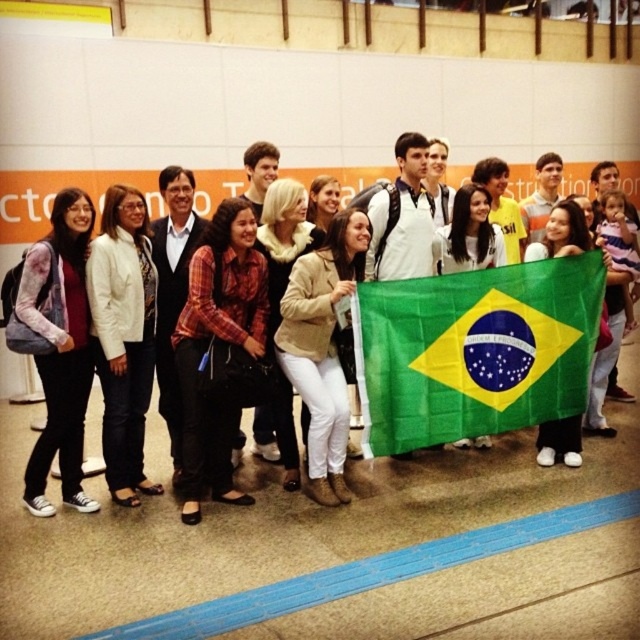
Is point (60, 307) farther from camera compared to point (333, 314)?

No, (60, 307) is closer to viewer.

Is matte black backpack at lower left taller than beige leather jacket at center?

Yes, matte black backpack at lower left is taller than beige leather jacket at center.

The width and height of the screenshot is (640, 640). I want to click on matte black backpack at lower left, so click(58, 348).

Does green fabric flag at center appear on the left side of matte black backpack at center?

Yes, green fabric flag at center is to the left of matte black backpack at center.

Does green fabric flag at center appear under matte black backpack at center?

Indeed, green fabric flag at center is positioned under matte black backpack at center.

Locate an element on the screen. This screenshot has width=640, height=640. green fabric flag at center is located at coordinates (474, 349).

Is matte black backpack at lower left below matte black backpack at center?

Yes, matte black backpack at lower left is below matte black backpack at center.

Which is in front, point (68, 451) or point (42, 228)?

Point (68, 451)

Image resolution: width=640 pixels, height=640 pixels. I want to click on matte black backpack at lower left, so click(x=58, y=348).